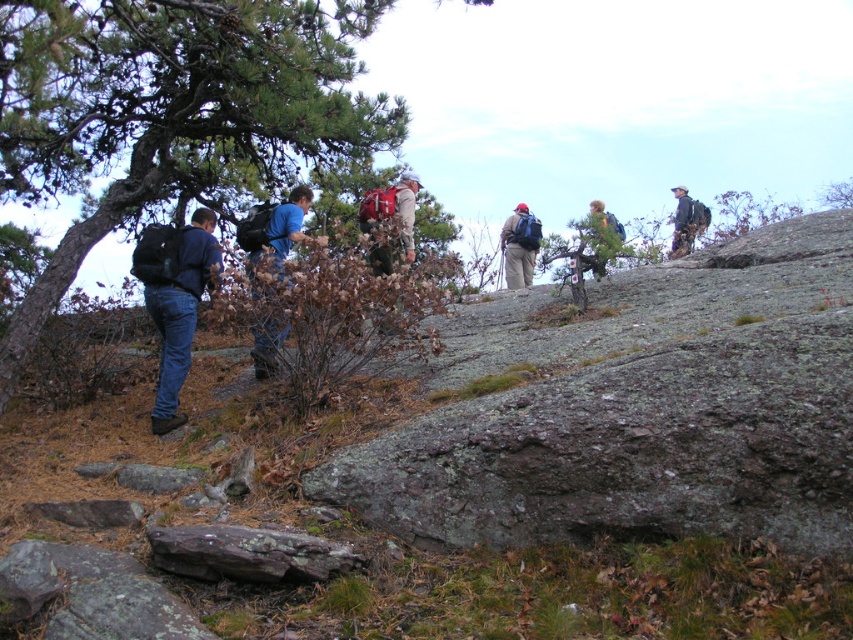
What do you see at coordinates (178, 310) in the screenshot? The height and width of the screenshot is (640, 853). I see `dark blue jeans at left` at bounding box center [178, 310].

Is dark blue jeans at left wider than blue fabric backpack at left?

Incorrect, dark blue jeans at left's width does not surpass blue fabric backpack at left's.

Between point (196, 273) and point (300, 193), which one is positioned behind?

Point (300, 193)

You are a GUI agent. You are given a task and a screenshot of the screen. Output one action in this format:
    pyautogui.click(x=<x>, y=<y>)
    Task: Click on the dark blue jeans at left
    The height and width of the screenshot is (640, 853).
    Given the screenshot: What is the action you would take?
    pyautogui.click(x=178, y=310)

How far apart are brown rough rock at center and camouflage jacket at upper right?

They are 6.58 meters apart.

Describe the element at coordinates (247, 554) in the screenshot. I see `brown rough rock at center` at that location.

Who is more distant from viewer, [196,531] or [683,189]?

Point [683,189]

At what (x,y) coordinates should I click in order to perform the action: click on brown rough rock at center. Please return your answer as a coordinate pair (x, y). This screenshot has width=853, height=640. Looking at the image, I should click on pos(247,554).

Is green leafy tree at upper left below matte blue backpack at center?

No, green leafy tree at upper left is not below matte blue backpack at center.

Can you confirm if green leafy tree at upper left is shorter than matte blue backpack at center?

In fact, green leafy tree at upper left may be taller than matte blue backpack at center.

Is point (251, 56) closer to camera compared to point (538, 228)?

Yes.

Find the location of `green leafy tree at upper left`. green leafy tree at upper left is located at coordinates (170, 112).